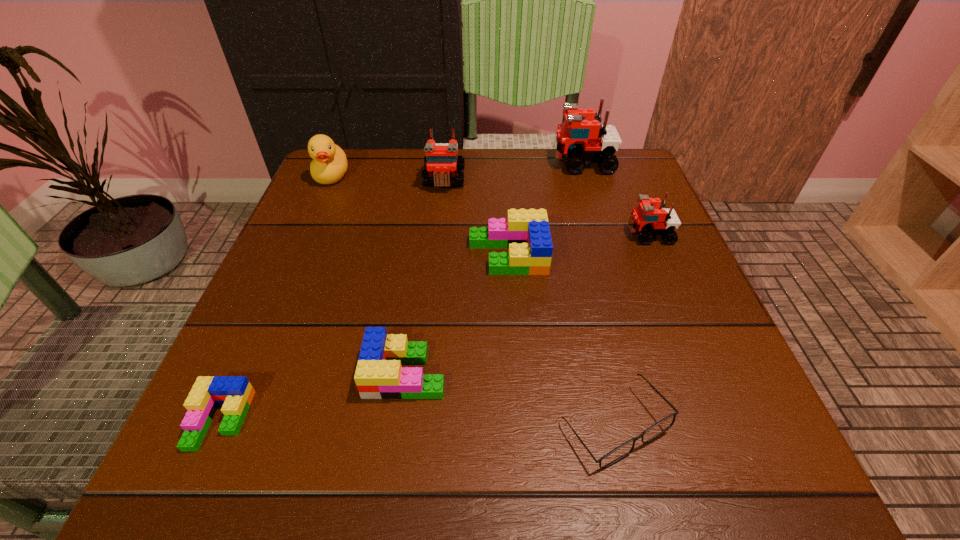
Where is `the tallest object`? This screenshot has width=960, height=540. the tallest object is located at coordinates (582, 138).

I want to click on the tallest Lego, so click(x=582, y=138).

Image resolution: width=960 pixels, height=540 pixels. Find the location of `the leftmost red Lego`. the leftmost red Lego is located at coordinates (441, 163).

I want to click on the second tallest Lego, so click(441, 163).

At what (x,y) coordinates should I click in order to perform the action: click on duck. Please return your answer as a coordinate pair (x, y). This screenshot has height=540, width=960. Looking at the image, I should click on click(x=329, y=165).

Locate an element on the screen. The image size is (960, 540). the third tallest Lego is located at coordinates (650, 217).

Locate an element on the screen. The image size is (960, 540). the nearest red Lego is located at coordinates (650, 217).

Locate an element on the screen. This screenshot has height=540, width=960. the farthest green Lego is located at coordinates (526, 233).

At what (x,y) coordinates should I click in order to perform the action: click on the fourth shortest object. Please return your answer as a coordinate pair (x, y). The width and height of the screenshot is (960, 540). Looking at the image, I should click on (526, 233).

This screenshot has width=960, height=540. In order to click on the second shortest Lego in this screenshot , I will do `click(379, 375)`.